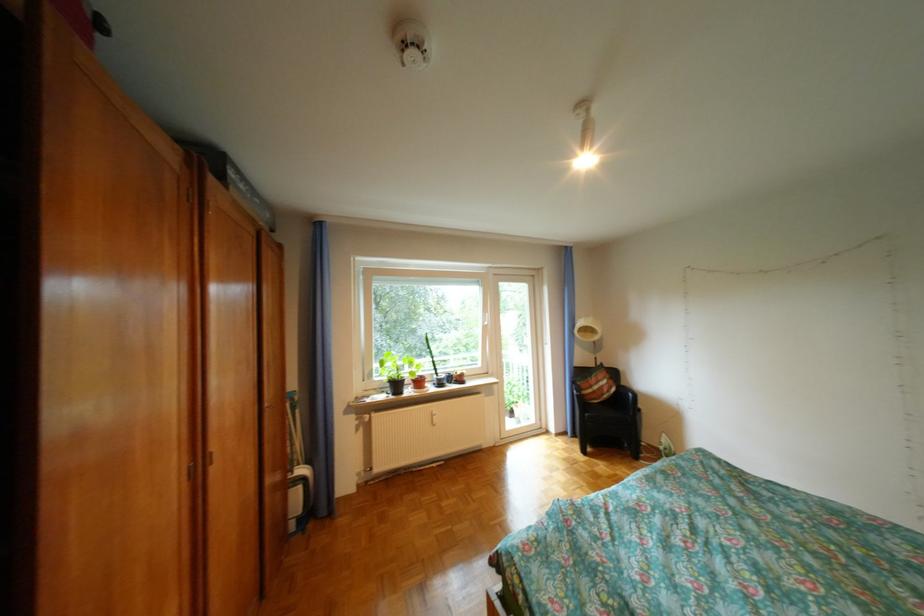
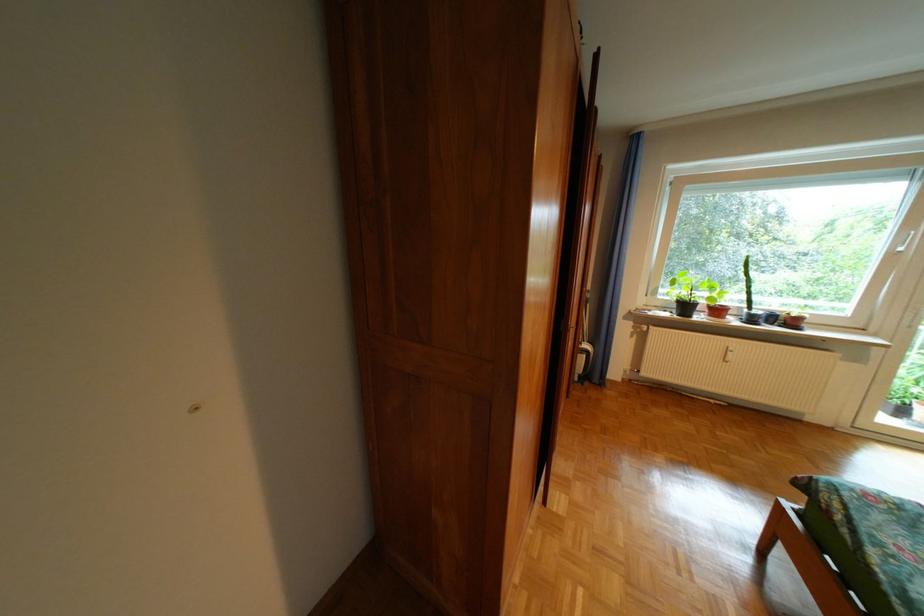
The point at (396,398) is marked in the first image. Where is the corresponding point in the second image?

(679, 315)